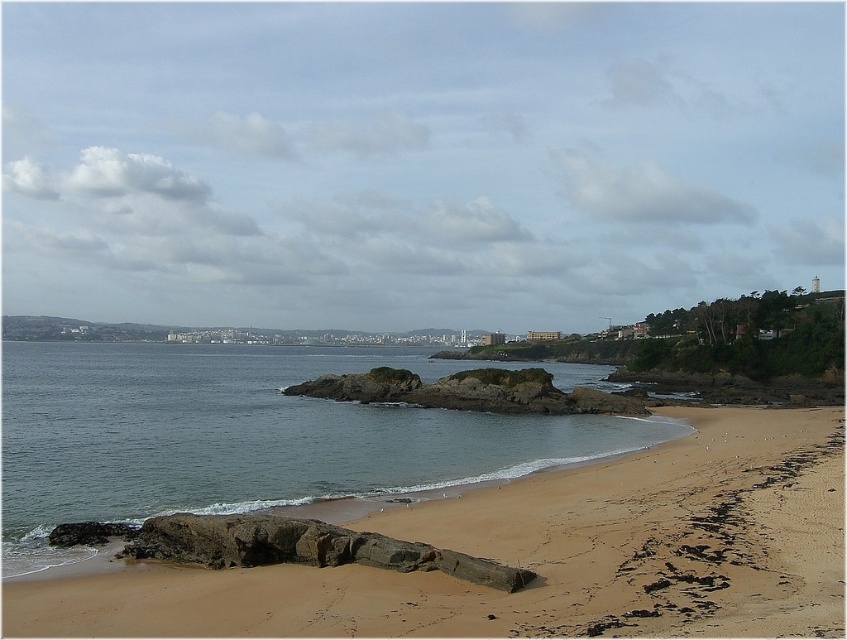
You are standing on the brown sandy beach at lower center and want to reach the brown rocky island at center. Based on the scene, which direction should you head towards to get there?

The brown rocky island at center is located towards the center of the image, so you should head towards the center from the brown sandy beach at lower center.

You are standing on the beach and want to walk to the brown rocky island at center. However, the clear water at beach center is in your path. Based on the scene description, can you reach the island without getting your feet wet?

The clear water at beach center is positioned under brown rocky island at center, meaning the water is between you and the island. To reach the island, you would have to wade through the water, so your feet will get wet.